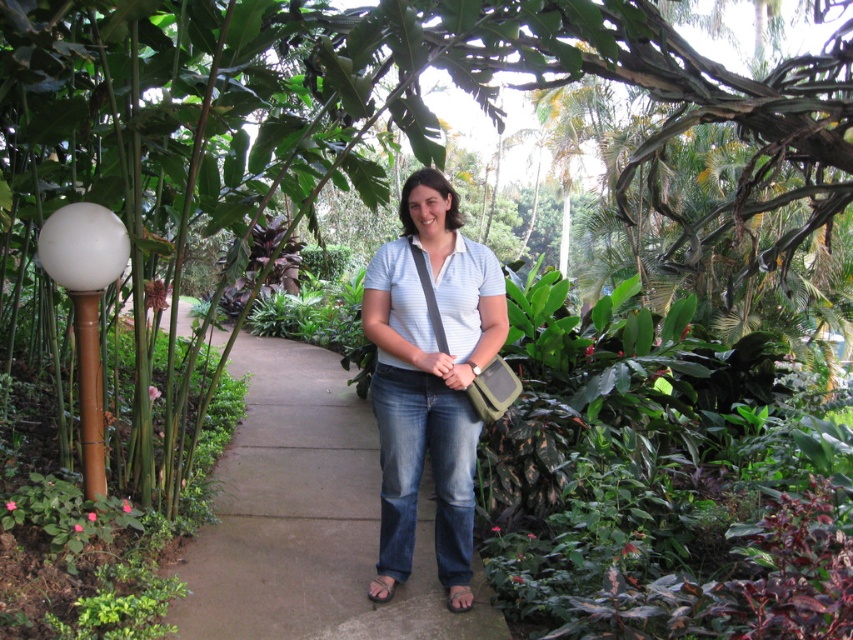
Question: Can you confirm if gray concrete pavement at center is positioned above matte blue shirt at center?

Choices:
 (A) no
 (B) yes

Answer: (A)

Question: Which point is closer to the camera?

Choices:
 (A) matte blue shirt at center
 (B) gray concrete pavement at center

Answer: (A)

Question: Which object appears farthest from the camera in this image?

Choices:
 (A) gray concrete pavement at center
 (B) matte blue shirt at center

Answer: (A)

Question: Is gray concrete pavement at center to the right of matte blue shirt at center from the viewer's perspective?

Choices:
 (A) yes
 (B) no

Answer: (B)

Question: Which point is farther from the camera taking this photo?

Choices:
 (A) (502, 632)
 (B) (376, 252)

Answer: (B)

Question: From the image, what is the correct spatial relationship of gray concrete pavement at center in relation to matte blue shirt at center?

Choices:
 (A) above
 (B) below

Answer: (B)